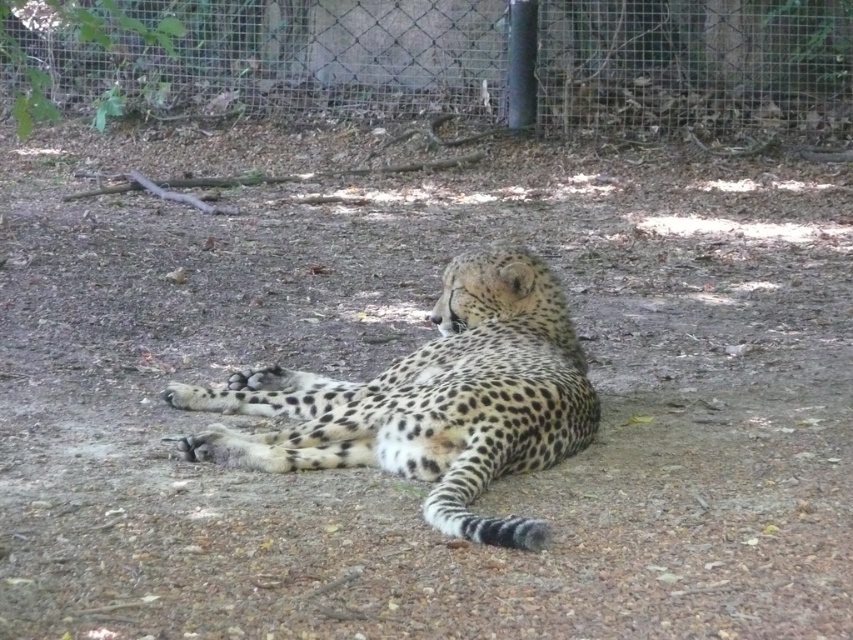
Question: Does wire mesh fence at center come behind spotted fur cheetah at center?

Choices:
 (A) yes
 (B) no

Answer: (A)

Question: Observing the image, what is the correct spatial positioning of wire mesh fence at center in reference to spotted fur cheetah at center?

Choices:
 (A) left
 (B) right

Answer: (A)

Question: Is wire mesh fence at center to the right of spotted fur cheetah at center from the viewer's perspective?

Choices:
 (A) no
 (B) yes

Answer: (A)

Question: Which of the following is the farthest from the observer?

Choices:
 (A) (189, 406)
 (B) (500, 61)

Answer: (B)

Question: Which of the following is the closest to the observer?

Choices:
 (A) spotted fur cheetah at center
 (B) wire mesh fence at center

Answer: (A)

Question: Which point is closer to the camera?

Choices:
 (A) (531, 435)
 (B) (764, 19)

Answer: (A)